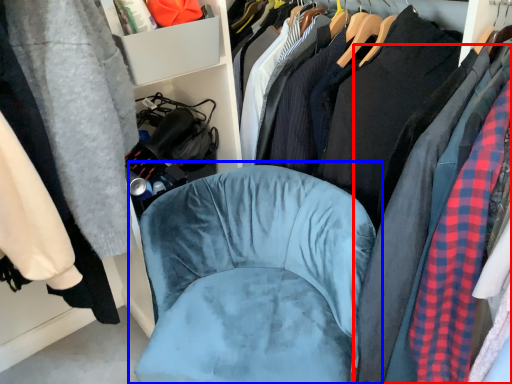
Question: Which object appears farthest to the camera in this image, clothing (highlighted by a red box) or chair (highlighted by a blue box)?

Choices:
 (A) clothing
 (B) chair

Answer: (B)